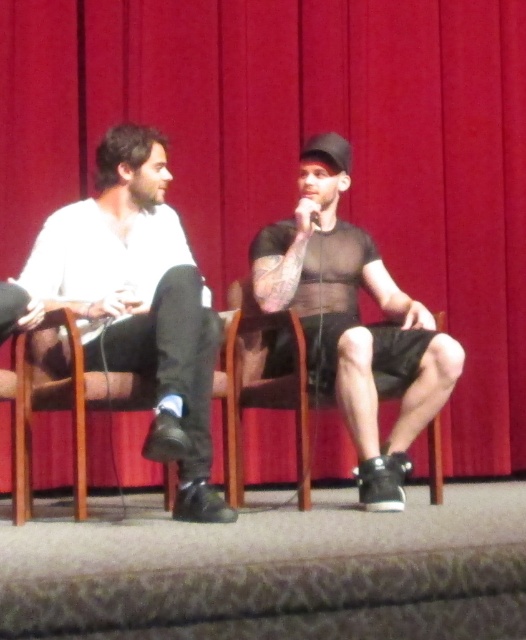
Which is above, matte white shirt at left or black matte microphone at center?

black matte microphone at center

Is matte white shirt at left bigger than black matte microphone at center?

Yes, matte white shirt at left is bigger than black matte microphone at center.

Does point (217, 320) come closer to viewer compared to point (312, 216)?

Yes, it is in front of point (312, 216).

Locate an element on the screen. The width and height of the screenshot is (526, 640). matte white shirt at left is located at coordinates (139, 301).

In the scene shown: Between matte white shirt at left and matte black shirt at center, which one appears on the right side from the viewer's perspective?

matte black shirt at center

Does matte white shirt at left lie behind matte black shirt at center?

No, it is in front of matte black shirt at center.

At what (x,y) coordinates should I click in order to perform the action: click on matte white shirt at left. Please return your answer as a coordinate pair (x, y). Image resolution: width=526 pixels, height=640 pixels. Looking at the image, I should click on (139, 301).

Can you confirm if matte black shirt at center is wider than black matte microphone at center?

Indeed, matte black shirt at center has a greater width compared to black matte microphone at center.

Who is lower down, matte black shirt at center or black matte microphone at center?

matte black shirt at center is below.

The width and height of the screenshot is (526, 640). What do you see at coordinates (353, 321) in the screenshot? I see `matte black shirt at center` at bounding box center [353, 321].

Identify the location of matte black shirt at center. This screenshot has height=640, width=526. (353, 321).